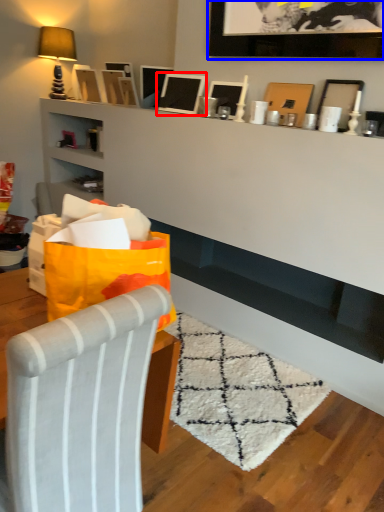
Question: Which point is closer to the camera, picture frame (highlighted by a red box) or picture frame (highlighted by a blue box)?

Choices:
 (A) picture frame
 (B) picture frame

Answer: (B)